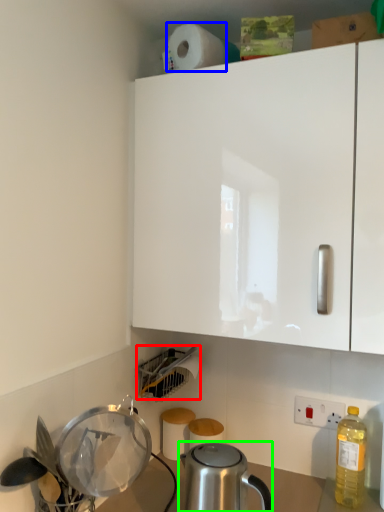
Question: Based on their relative distances, which object is farther from appliance (highlighted by a red box)? Choose from paper towel (highlighted by a blue box) and kettle (highlighted by a green box).

Choices:
 (A) paper towel
 (B) kettle

Answer: (A)